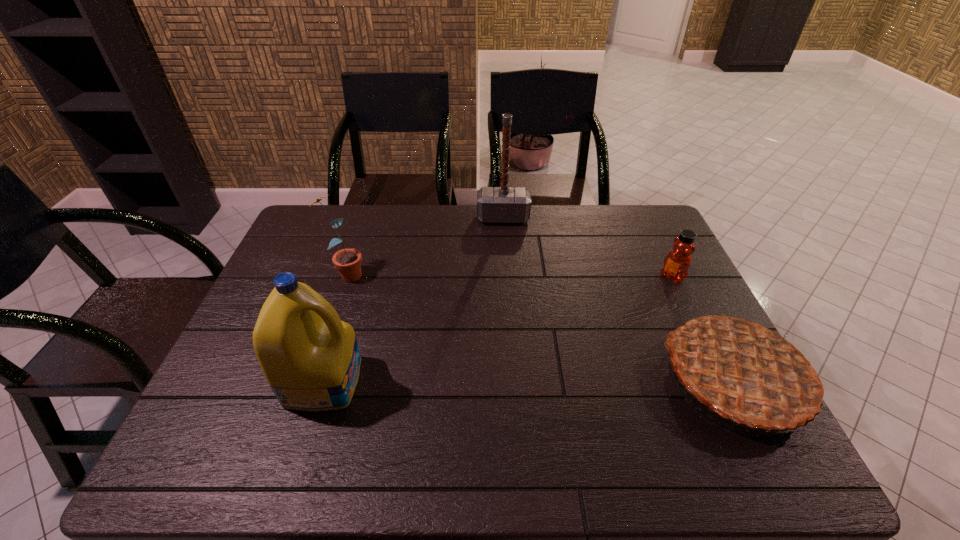
At what (x,y) coordinates should I click in order to perform the action: click on vacant region located 0.260m on the striking surface of the hammer. Please return your answer as a coordinate pair (x, y). Image resolution: width=960 pixels, height=540 pixels. Looking at the image, I should click on (504, 277).

Identify the location of free space located 0.220m on the front label of the honey. This screenshot has height=540, width=960. click(x=617, y=315).

Locate an element on the screen. This screenshot has width=960, height=540. vacant region located 0.050m on the front label of the honey is located at coordinates (655, 289).

Identify the location of free space located on the front label of the honey. (655, 289).

The width and height of the screenshot is (960, 540). What are the coordinates of `vacant space situated 0.180m on the flower of the sunflower` in the screenshot? It's located at (407, 302).

Identify the location of free spot located 0.240m on the flower of the sunflower. click(x=424, y=310).

You are a GUI agent. You are given a task and a screenshot of the screen. Output one action in this format:
    pyautogui.click(x=<x>, y=<y>)
    Task: Click on the free spot located on the flower of the sunflower
    
    Given the screenshot: What is the action you would take?
    pyautogui.click(x=427, y=312)

Find the location of a particular element. This screenshot has width=960, height=540. object located at the far edge is located at coordinates (504, 204).

You are a GUI agent. You are given a task and a screenshot of the screen. Output one action in this format:
    pyautogui.click(x=<x>, y=<y>)
    Task: Click on the detergent that is at the near edge
    Image resolution: width=960 pixels, height=540 pixels.
    Given the screenshot: What is the action you would take?
    pyautogui.click(x=310, y=358)

Where is `pie positioned at the near edge`? The image size is (960, 540). pie positioned at the near edge is located at coordinates (747, 370).